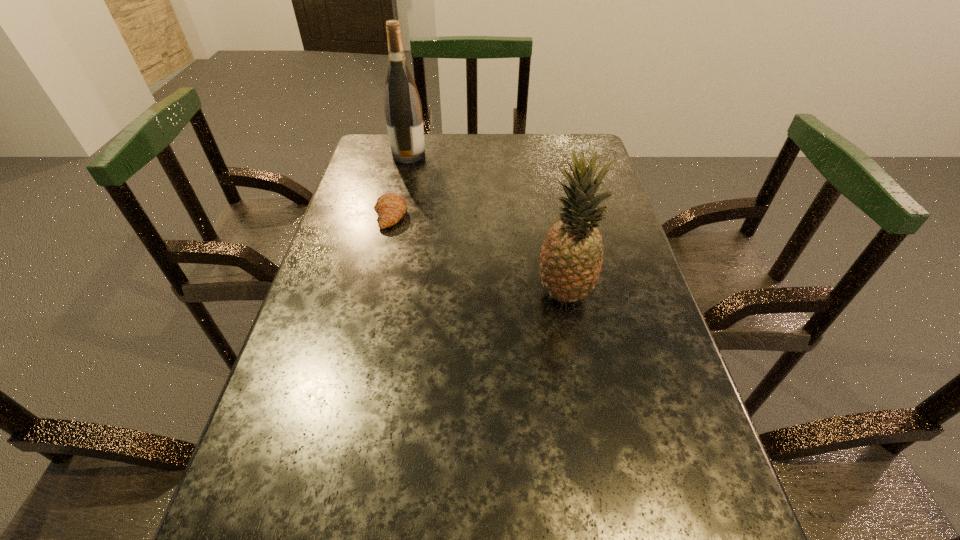
Locate an element on the screen. This screenshot has height=540, width=960. wine bottle is located at coordinates (403, 111).

Find the location of a particular element. the rightmost object is located at coordinates (571, 257).

The image size is (960, 540). In order to click on pineapple in this screenshot , I will do [x=571, y=257].

The image size is (960, 540). In order to click on the second nearest object in this screenshot , I will do click(x=390, y=207).

Locate an element on the screen. crescent roll is located at coordinates (390, 207).

Locate an element on the screen. The image size is (960, 540). vacant space situated 0.150m on the label of the wine bottle is located at coordinates (473, 156).

Locate an element on the screen. Image resolution: width=960 pixels, height=540 pixels. vacant point located 0.210m on the left of the pineapple is located at coordinates (441, 293).

This screenshot has height=540, width=960. In order to click on free location located on the right of the crescent roll in this screenshot , I will do `click(530, 215)`.

Where is `object that is positioned at the far edge`? This screenshot has width=960, height=540. object that is positioned at the far edge is located at coordinates (403, 111).

The width and height of the screenshot is (960, 540). Identify the location of wine bottle located in the left edge section of the desktop. (403, 111).